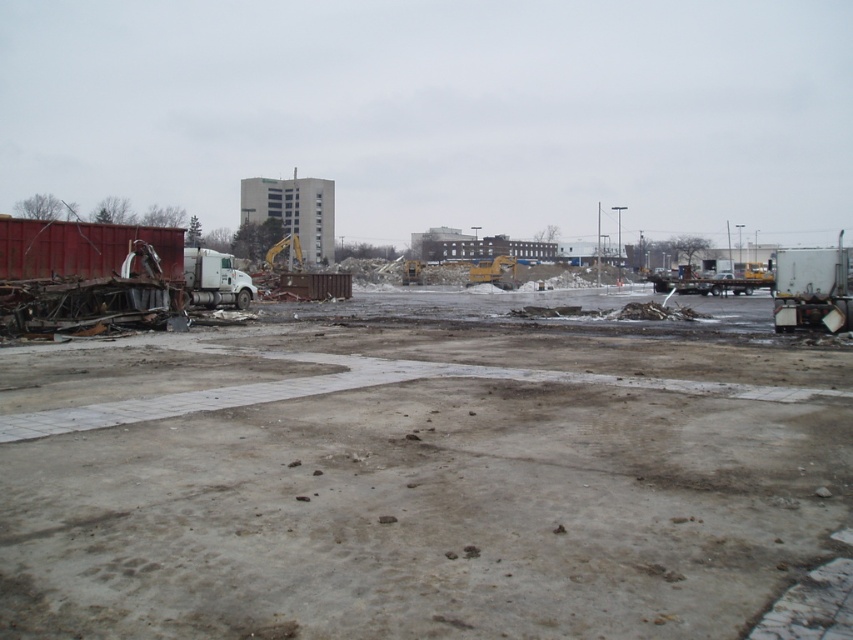
Question: Observing the image, what is the correct spatial positioning of white matte trailer truck at right in reference to white matte trailer truck at left?

Choices:
 (A) right
 (B) left

Answer: (A)

Question: Can you confirm if rusty metal debris at left is positioned below white matte trailer truck at left?

Choices:
 (A) no
 (B) yes

Answer: (B)

Question: Can you confirm if white matte trailer truck at right is thinner than white matte trailer truck at left?

Choices:
 (A) no
 (B) yes

Answer: (A)

Question: Which object appears closest to the camera in this image?

Choices:
 (A) rusty metal debris at left
 (B) white matte trailer truck at right
 (C) white matte trailer truck at left

Answer: (A)

Question: Which object is closer to the camera taking this photo?

Choices:
 (A) rusty metal debris at left
 (B) white matte trailer truck at right
 (C) white matte trailer truck at left

Answer: (A)

Question: Which of the following is the closest to the observer?

Choices:
 (A) white matte trailer truck at right
 (B) rusty metal debris at left
 (C) white matte trailer truck at left

Answer: (B)